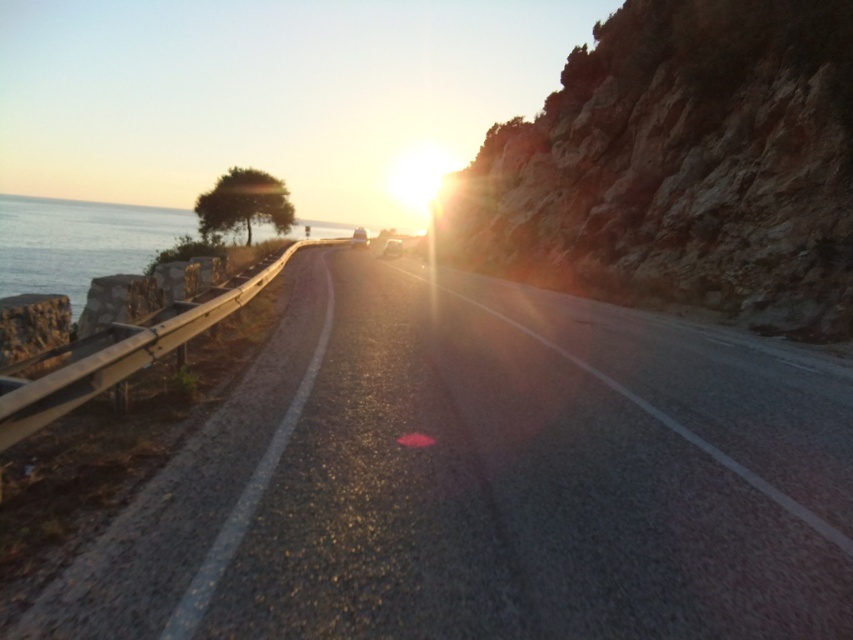
In the scene shown: You are standing at the point with coordinates (483, 481) on the coastal road. What type of surface are you currently standing on?

The surface at point (483, 481) is asphalt road at center.

You are a hiker planning to cross from the rocky cliff at right to the blue water at left. The path between them is 60.55 meters. If your backpack has a weight limit of 50 kilograms, and you need to carry enough water for the trip, how much water can you safely carry?

The question cannot be answered with the provided information. The distance between the rocky cliff at right and blue water at left is 60.55 meters, but there is no data about the required water per kilometer or the hiker s physical condition.

In the scene shown: You are standing at the starting point of the coastal road and want to reach the end of the road. Which of the two points, point 1 at coordinates point (675, 424) or point 2 at coordinates point (39, 204), would you encounter first while walking along the road?

You would encounter point 1 at coordinates point (675, 424) first because it is closer to the viewer than point 2 at coordinates point (39, 204).